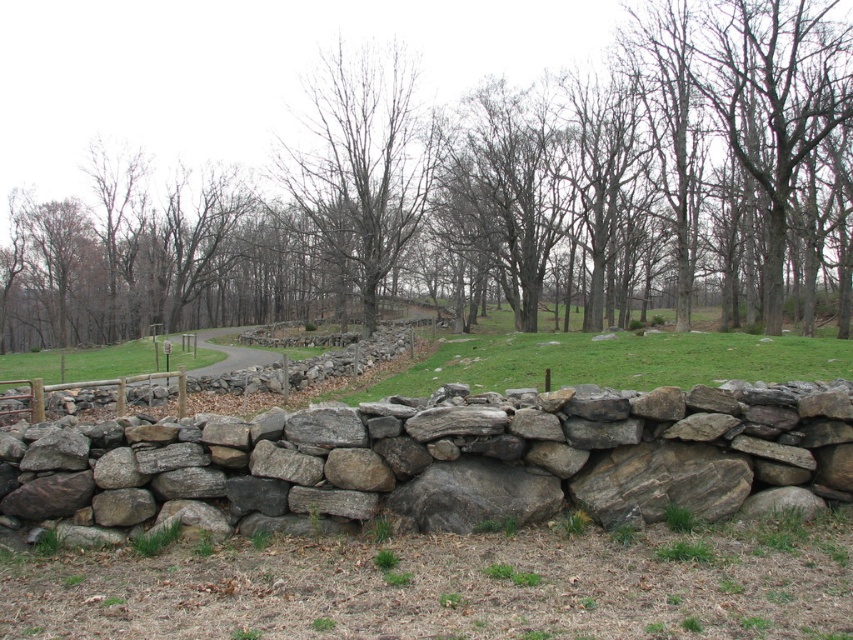
You are standing in front of the stone wall and see the smooth bark tree at center and the bare wood tree at center. Which tree is closer to you?

The smooth bark tree at center is closer to you because it is in front of the bare wood tree at center.

You are standing in front of the natural stone wall at center and want to find the smooth bark tree at center. In which direction should you look?

The smooth bark tree at center is to the left of the natural stone wall at center, so you should look to your left.